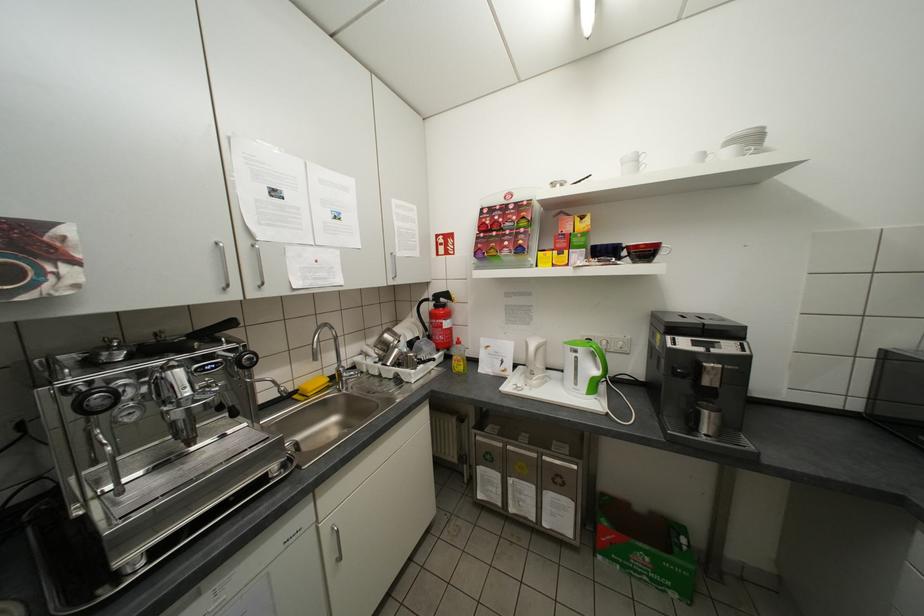
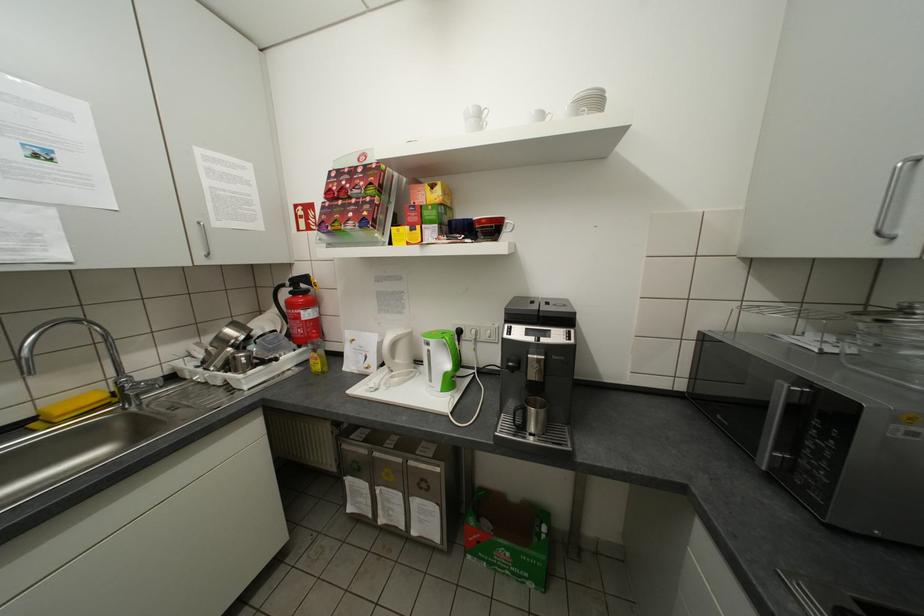
Locate, in the second image, the point that corresponds to point 712,156 in the first image.

(551, 116)